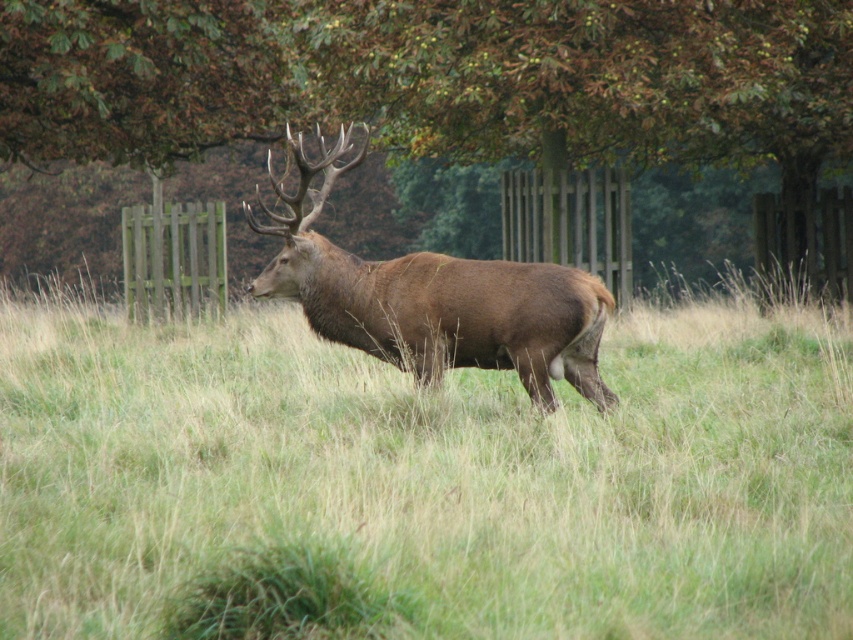
Is brown matte grass at center wider than brown velvet deer at center?

Yes.

Who is higher up, brown matte grass at center or brown velvet deer at center?

brown velvet deer at center is above.

Is point (332, 500) positioned after point (347, 259)?

No, (332, 500) is in front of (347, 259).

Locate an element on the screen. This screenshot has width=853, height=640. brown matte grass at center is located at coordinates (433, 474).

Does green leafy tree at upper center appear on the left side of brown velvet deer at center?

Indeed, green leafy tree at upper center is positioned on the left side of brown velvet deer at center.

Is green leafy tree at upper center closer to camera compared to brown velvet deer at center?

No, green leafy tree at upper center is behind brown velvet deer at center.

Describe the element at coordinates (432, 77) in the screenshot. I see `green leafy tree at upper center` at that location.

Locate an element on the screen. The height and width of the screenshot is (640, 853). green leafy tree at upper center is located at coordinates (432, 77).

Is point (376, 416) positioned in front of point (734, 28)?

That is True.

Does brown matte grass at center have a smaller size compared to green leafy tree at upper center?

Yes.

Which is behind, point (183, 465) or point (618, 120)?

Point (618, 120)

The height and width of the screenshot is (640, 853). Identify the location of brown matte grass at center. (433, 474).